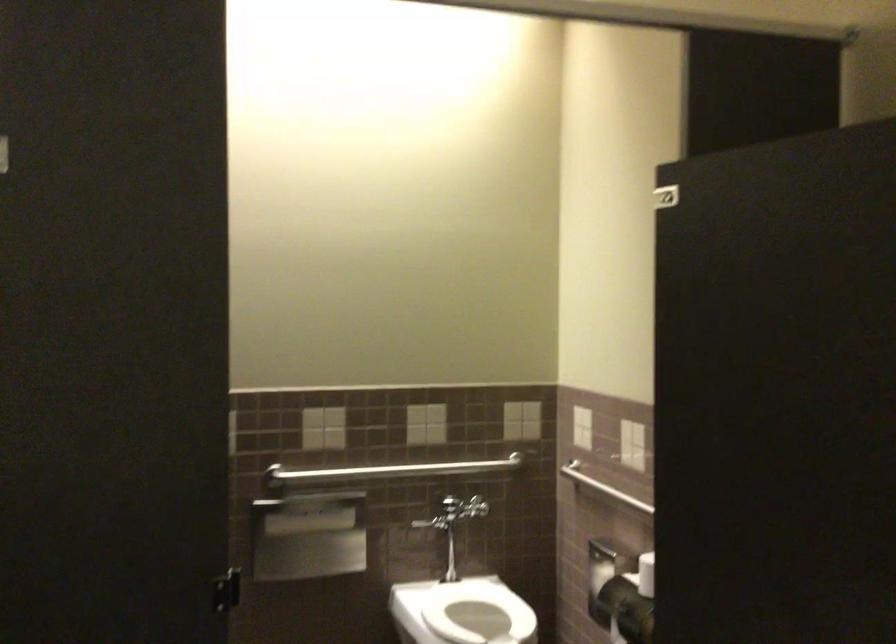
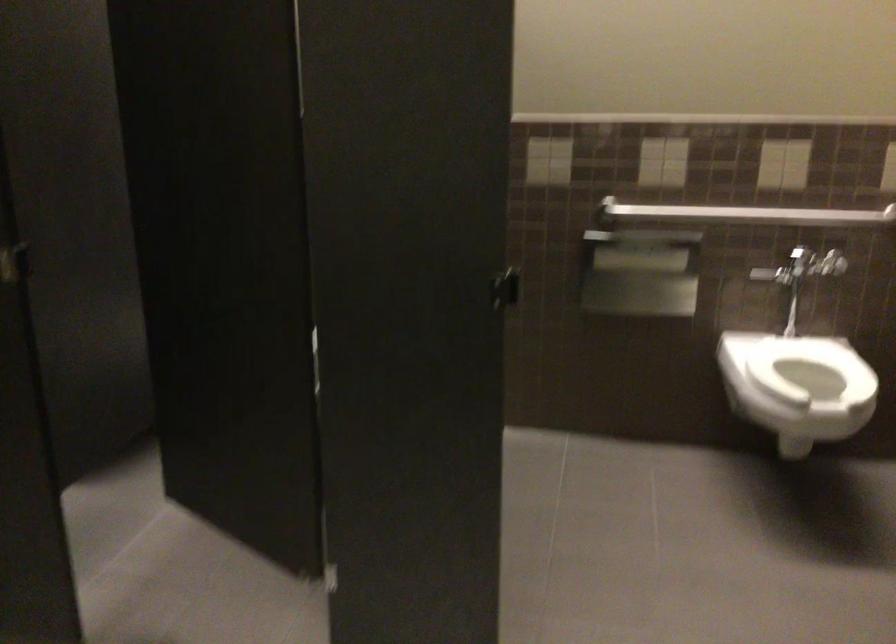
Locate, in the second image, the point that corresponds to [393,473] in the first image.

(745, 214)